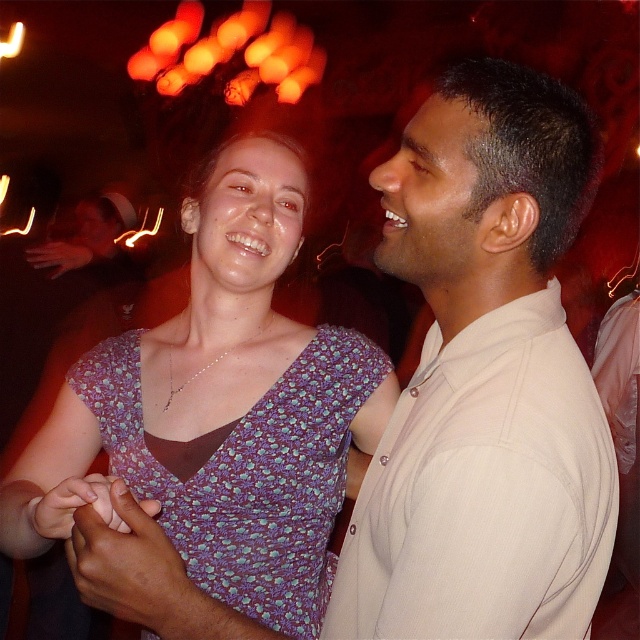
You are standing in the room and want to locate the white smooth shirt at right. According to the coordinates provided, where should you look?

You should look at point 0.595 on the x axis and 0.758 on the y axis to find the white smooth shirt at right.

You are planning to take a photo of the white smooth shirt at right and the purple floral fabric dress at center. Which object should you focus on first if you want to capture both in the frame without moving the camera?

The white smooth shirt at right has a smaller size compared to the purple floral fabric dress at center, so you should focus on the purple floral fabric dress at center first to ensure it is properly in frame.